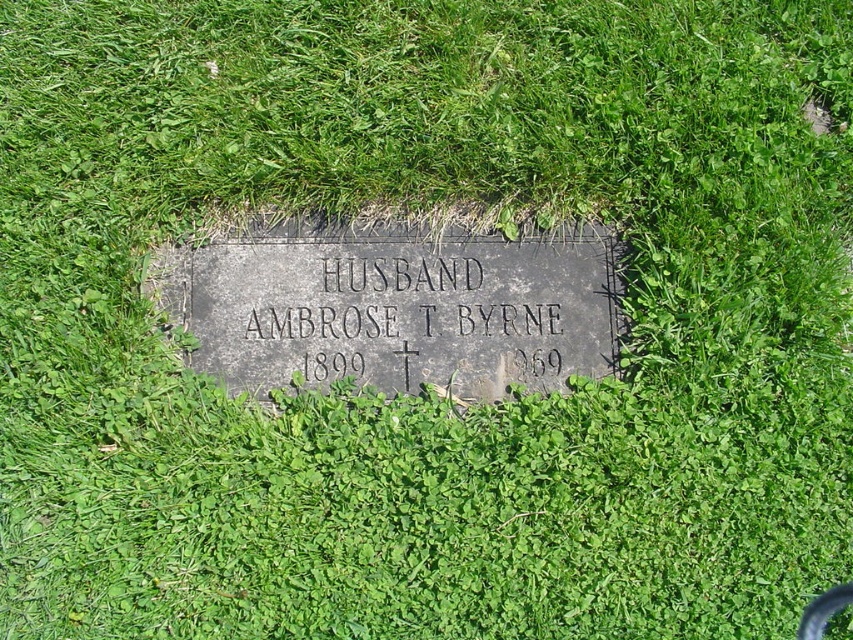
Does dark gray stone plaque at center appear under black stone plaque at center?

No.

Is dark gray stone plaque at center to the left of black stone plaque at center from the viewer's perspective?

Correct, you'll find dark gray stone plaque at center to the left of black stone plaque at center.

Identify the location of dark gray stone plaque at center. The width and height of the screenshot is (853, 640). (393, 308).

The height and width of the screenshot is (640, 853). I want to click on dark gray stone plaque at center, so click(x=393, y=308).